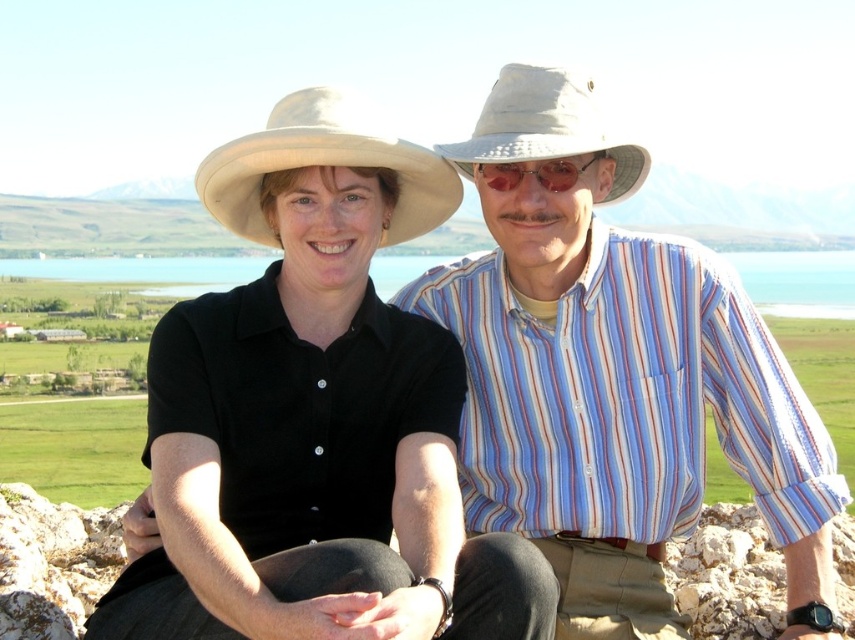
Is striped cotton shirt at center bigger than shiny metallic sunglasses at center?

Yes.

Can you confirm if striped cotton shirt at center is wider than shiny metallic sunglasses at center?

Yes.

Between point (800, 483) and point (593, 152), which one is positioned behind?

Positioned behind is point (593, 152).

Find the location of `striped cotton shirt at center`. striped cotton shirt at center is located at coordinates point(615,378).

Can you confirm if matte black hat at center is positioned above shiny metallic sunglasses at center?

Incorrect, matte black hat at center is not positioned above shiny metallic sunglasses at center.

Who is more distant from viewer, [236,200] or [519,179]?

Point [519,179]

Is point (275, 609) positioned in front of point (558, 192)?

Yes, point (275, 609) is closer to viewer.

At what (x,y) coordinates should I click in order to perform the action: click on matte black hat at center. Please return your answer as a coordinate pair (x, y). Image resolution: width=855 pixels, height=640 pixels. Looking at the image, I should click on (326, 202).

Does striped cotton shirt at center appear over matte black hat at center?

Indeed, striped cotton shirt at center is positioned over matte black hat at center.

I want to click on striped cotton shirt at center, so click(615, 378).

Does point (691, 426) lie behind point (394, 154)?

That is True.

Find the location of `striped cotton shirt at center`. striped cotton shirt at center is located at coordinates (615, 378).